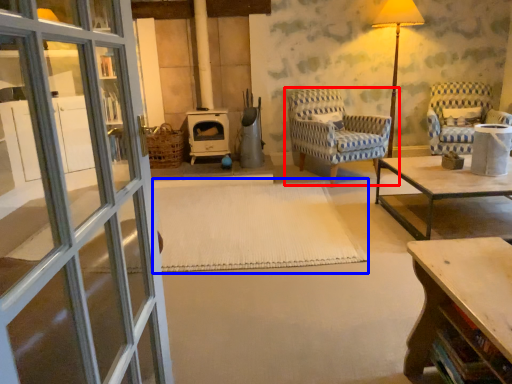
Question: Which point is closer to the camera, chair (highlighted by a red box) or mat (highlighted by a blue box)?

Choices:
 (A) chair
 (B) mat

Answer: (B)